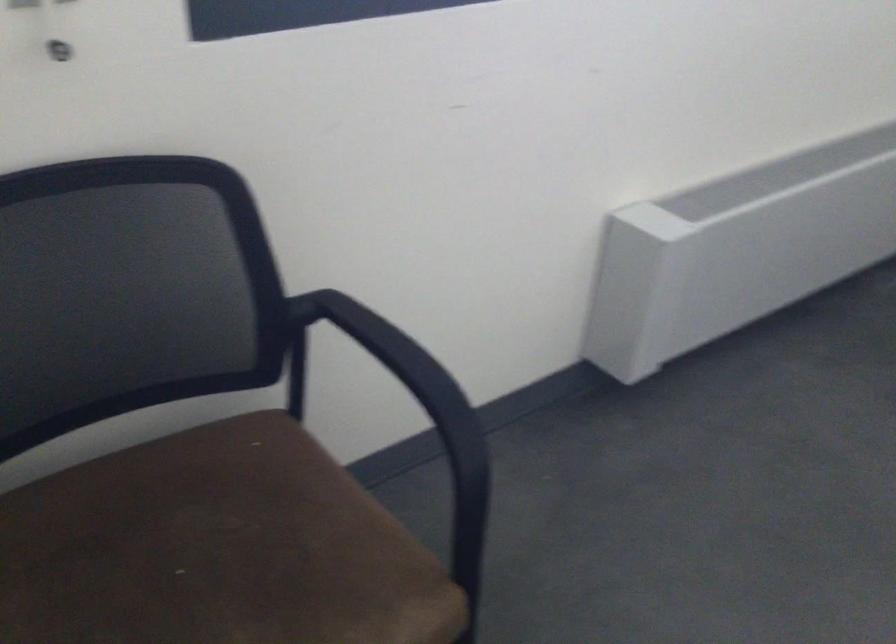
Find the location of a particular element. black chair armrest is located at coordinates (419, 410).